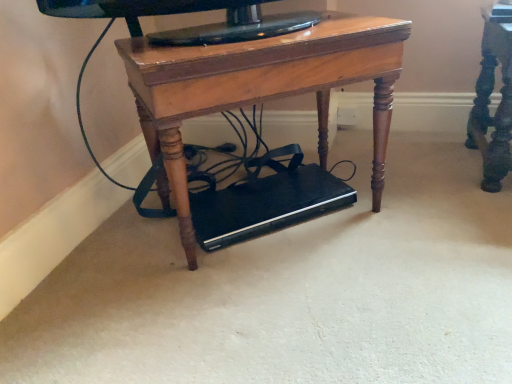
This screenshot has width=512, height=384. In order to click on free location in front of wooden table at center in this screenshot , I will do `click(281, 306)`.